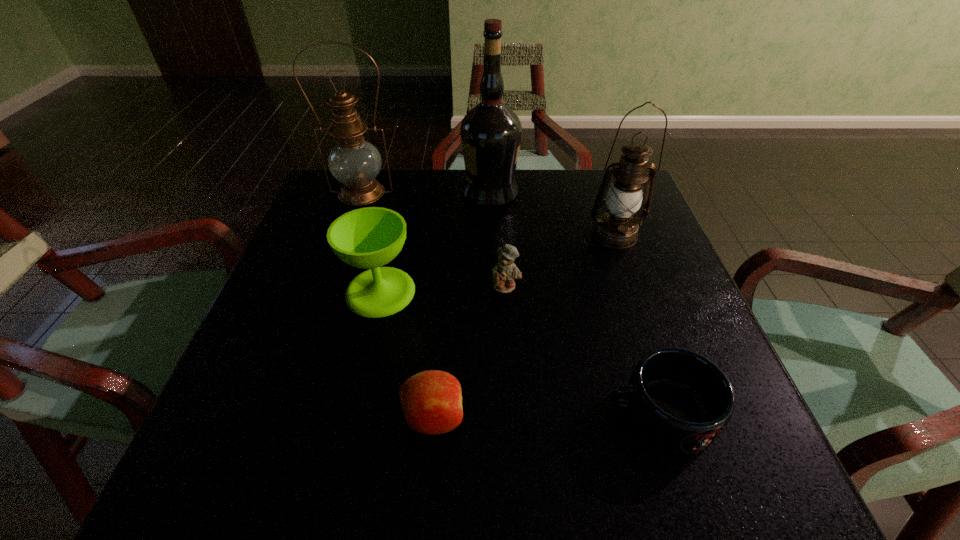
Locate an element on the screen. This screenshot has width=960, height=540. liquor is located at coordinates pyautogui.click(x=491, y=132).

Where is `the left oil lamp`? The image size is (960, 540). the left oil lamp is located at coordinates (353, 161).

Image resolution: width=960 pixels, height=540 pixels. What are the coordinates of `the shorter oil lamp` in the screenshot? It's located at (616, 228).

Where is `the right oil lamp`? This screenshot has width=960, height=540. the right oil lamp is located at coordinates (616, 228).

This screenshot has width=960, height=540. I want to click on wineglass, so click(x=368, y=238).

I want to click on teddy bear, so click(x=505, y=271).

In order to click on apple in this screenshot , I will do pos(431,400).

Image resolution: width=960 pixels, height=540 pixels. In order to click on mug in this screenshot , I will do `click(679, 401)`.

Image resolution: width=960 pixels, height=540 pixels. I want to click on free spot located on the surface of the liquor, so click(409, 192).

Identify the location of vacant space located on the surface of the liquor. The image size is (960, 540). (334, 192).